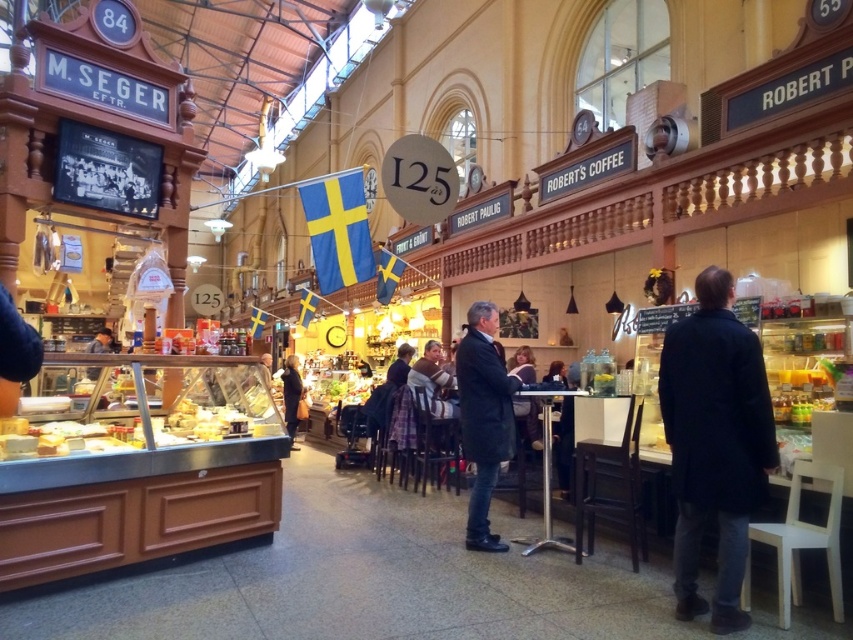
In the scene shown: Is dark blue coat at center above dark gray coat at center?

Yes.

Does dark blue coat at center lie in front of dark gray coat at center?

Yes.

Image resolution: width=853 pixels, height=640 pixels. I want to click on dark blue coat at center, so click(x=714, y=442).

I want to click on dark gray coat at center, so click(x=483, y=417).

Can you confirm if dark gray coat at center is shorter than dark brown leather jacket at center?

In fact, dark gray coat at center may be taller than dark brown leather jacket at center.

What do you see at coordinates (483, 417) in the screenshot? The image size is (853, 640). I see `dark gray coat at center` at bounding box center [483, 417].

At what (x,y) coordinates should I click in order to perform the action: click on dark gray coat at center. Please return your answer as a coordinate pair (x, y). Image resolution: width=853 pixels, height=640 pixels. Looking at the image, I should click on (483, 417).

Is point (735, 422) in front of point (297, 356)?

Yes, it is in front of point (297, 356).

The image size is (853, 640). I want to click on dark blue coat at center, so pos(714,442).